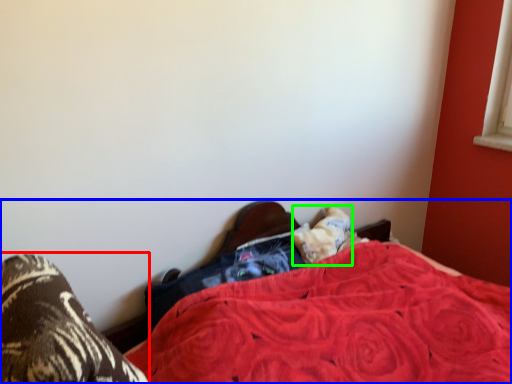
Question: Considering the real-world distances, which object is closest to footwear (highlighted by a red box)? bed (highlighted by a blue box) or pillow (highlighted by a green box).

Choices:
 (A) bed
 (B) pillow

Answer: (A)